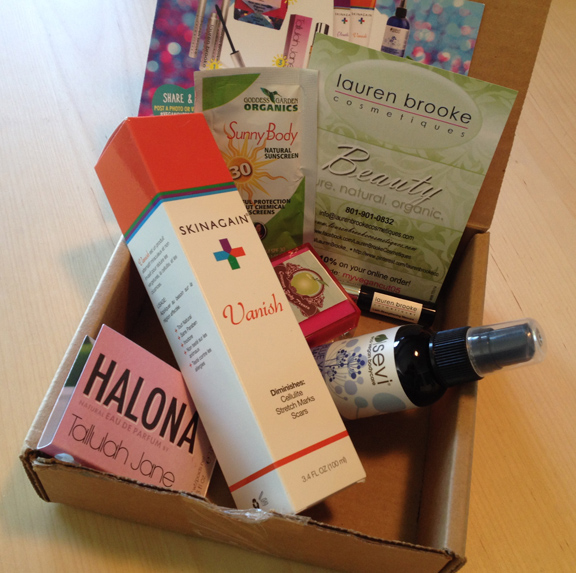
At what (x,y) coordinates should I click in order to perform the action: click on wooden table top. Please return your answer as a coordinate pair (x, y). Image resolution: width=576 pixels, height=573 pixels. Looking at the image, I should click on (543, 255).